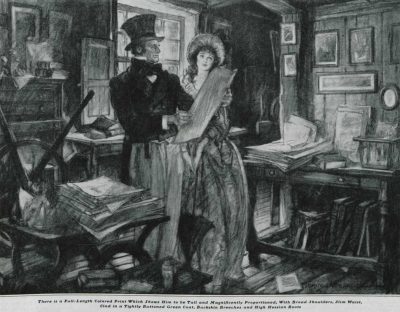
The height and width of the screenshot is (312, 400). I want to click on framed pictures, so click(394, 49), click(359, 51), click(335, 52), click(294, 38), click(287, 65), click(330, 79), click(58, 32), click(22, 28).